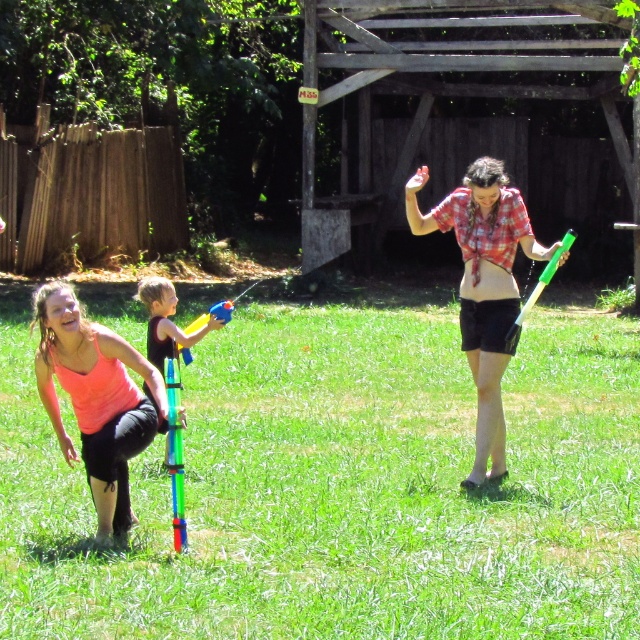
Question: Estimate the real-world distances between objects in this image. Which object is closer to the pink matte tank top at lower left?

Choices:
 (A) green grass at center
 (B) plaid shirt at center

Answer: (A)

Question: Which point is farther to the camera?

Choices:
 (A) (198, 330)
 (B) (44, 368)
 (C) (227, 550)
 (D) (444, 216)

Answer: (A)

Question: Which point is closer to the camera?

Choices:
 (A) (68, 332)
 (B) (176, 570)

Answer: (B)

Question: Is green grass at center bigger than pink matte tank top at lower left?

Choices:
 (A) yes
 (B) no

Answer: (A)

Question: Is pink matte tank top at lower left thinner than plaid shirt at center?

Choices:
 (A) no
 (B) yes

Answer: (B)

Question: In this image, where is green grass at center located relative to translucent plastic water gun at center?

Choices:
 (A) right
 (B) left

Answer: (A)